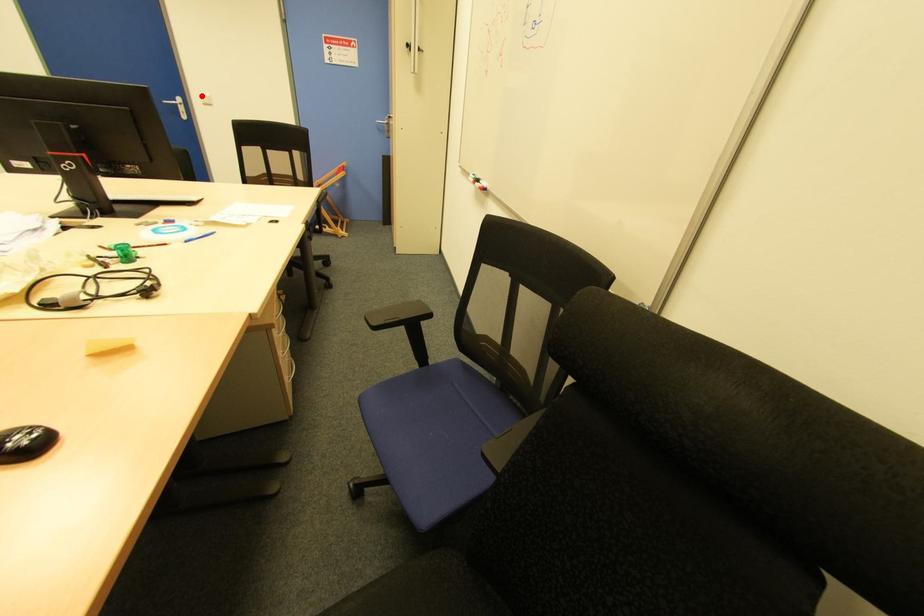
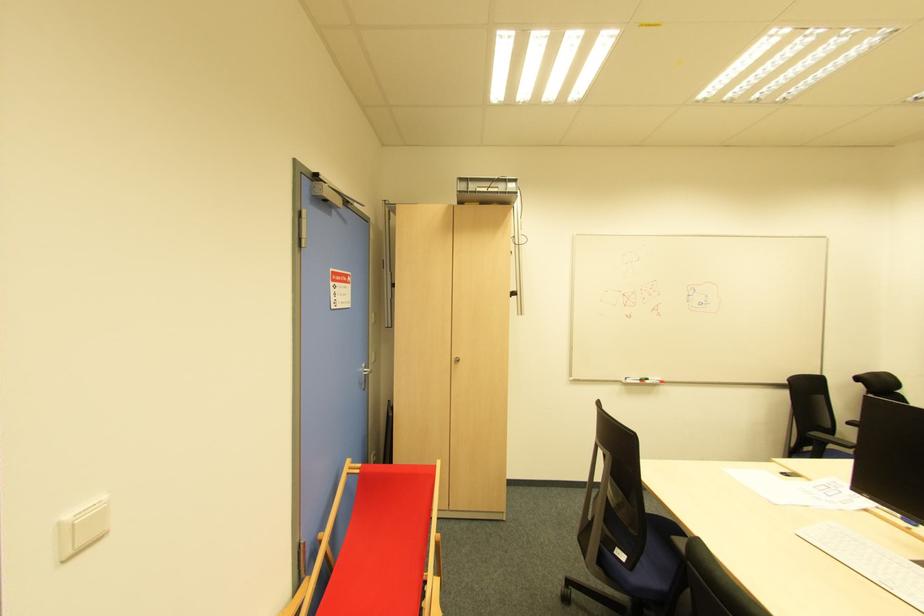
Question: I am providing you with two images of the same scene from different viewpoints. Image1 has a red point marked. In image2, the corresponding 3D location appears at what relative position? Reply with the corresponding letter.

Choices:
 (A) Closer
 (B) Farther

Answer: (A)